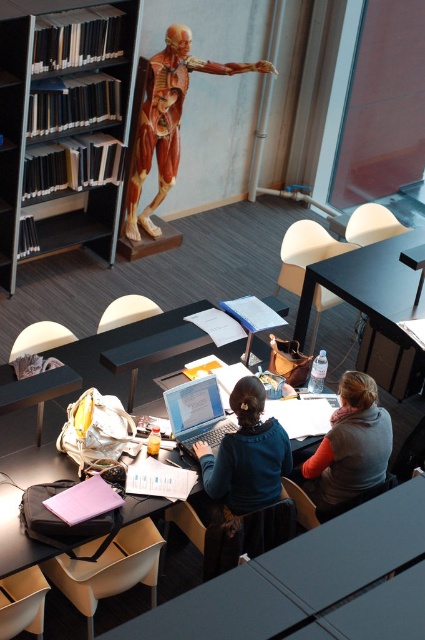
Question: Which of the following is the closest to the observer?

Choices:
 (A) black plastic table at center
 (B) matte black table at lower left
 (C) blue fabric shirt at center

Answer: (B)

Question: Is matte black table at lower left smaller than gray fleece jacket at center?

Choices:
 (A) no
 (B) yes

Answer: (A)

Question: Does black plastic bookcase at left come behind matte black table at center?

Choices:
 (A) yes
 (B) no

Answer: (A)

Question: Which object is farther from the camera taking this photo?

Choices:
 (A) black plastic bookcase at left
 (B) smooth flesh-colored anatomical model at upper center
 (C) gray fleece jacket at center

Answer: (B)

Question: Estimate the real-world distances between objects in this image. Which object is closer to the blue fabric shirt at center?

Choices:
 (A) silver metallic laptop at center
 (B) gray fleece jacket at center
 (C) smooth flesh-colored anatomical model at upper center
 (D) black plastic table at center

Answer: (A)

Question: Can you confirm if blue fabric shirt at center is smaller than black plastic table at center?

Choices:
 (A) no
 (B) yes

Answer: (B)